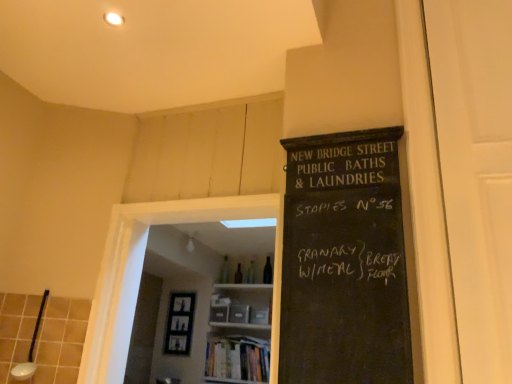
Question: Which is correct: white ceramic spoon at lower left is inside transparent glass door at center, acting as the 1th glass door starting from the back, or outside of it?

Choices:
 (A) outside
 (B) inside

Answer: (A)

Question: From the image's perspective, is white ceramic spoon at lower left located above or below transparent glass door at center, which is the first glass door in left-to-right order?

Choices:
 (A) below
 (B) above

Answer: (A)

Question: Which is nearer to the wooden bookshelf at center?

Choices:
 (A) black chalkboard at right
 (B) transparent glass door at center, the 2th glass door viewed from the right
 (C) hardcover books at center
 (D) white matte door at right, marked as the 2th glass door in a left-to-right arrangement
 (E) white ceramic spoon at lower left

Answer: (C)

Question: Considering the real-world distances, which object is closest to the white ceramic spoon at lower left?

Choices:
 (A) black chalkboard at right
 (B) transparent glass door at center, which is the first glass door in left-to-right order
 (C) wooden bookshelf at center
 (D) white matte door at right, which ranks as the 1th glass door in right-to-left order
 (E) hardcover books at center

Answer: (B)